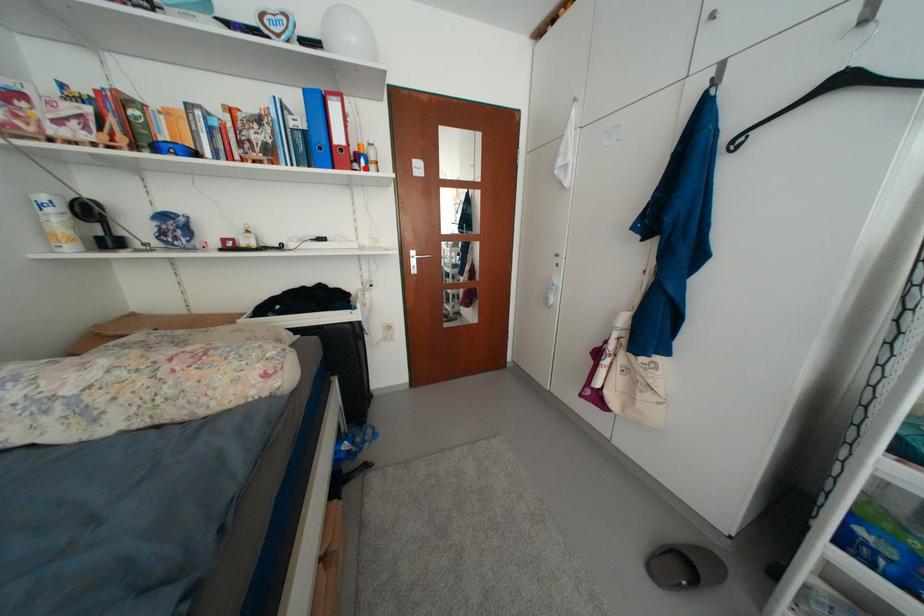
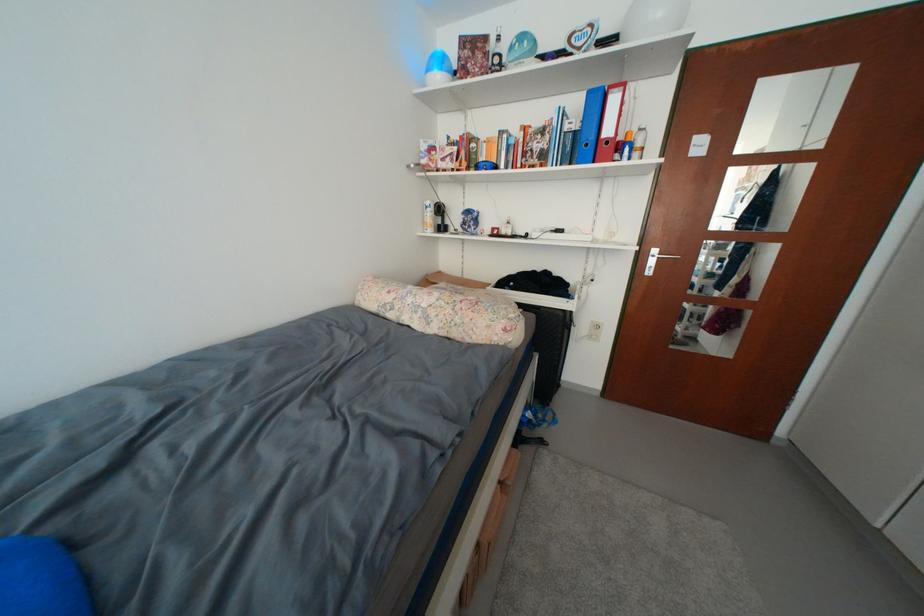
The point at the highlighted location is marked in the first image. Where is the corresponding point in the second image?

(626, 159)